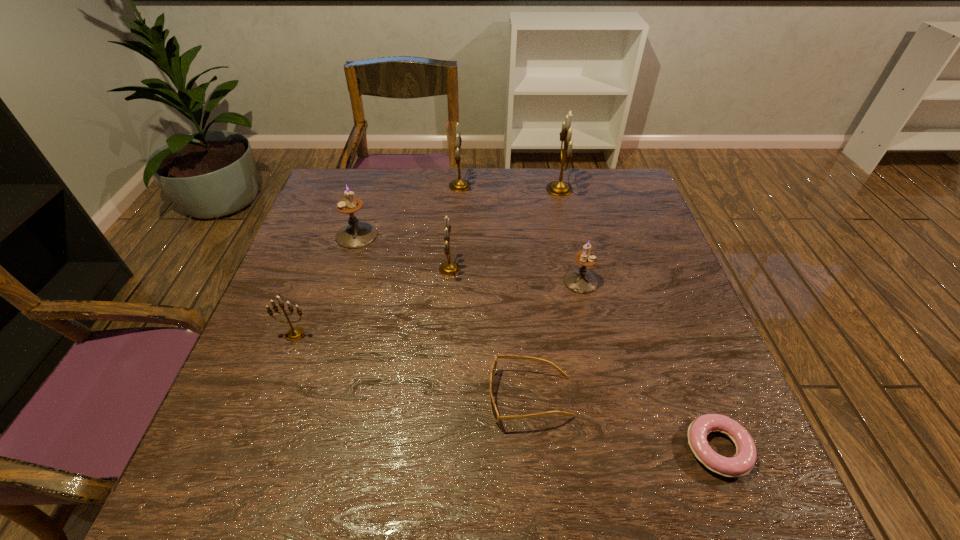
I want to click on free point located 0.110m on the front of the smallest gold candelabrum, so click(x=276, y=387).

You are a GUI agent. You are given a task and a screenshot of the screen. Output one action in this format:
    pyautogui.click(x=<x>, y=<y>)
    Task: Click on the free location located 0.400m on the front-facing side of the seventh tallest object
    The width and height of the screenshot is (960, 540).
    Given the screenshot: What is the action you would take?
    pyautogui.click(x=285, y=397)

Where is `vacant space situated on the front-facing side of the seventh tallest object`? The width and height of the screenshot is (960, 540). vacant space situated on the front-facing side of the seventh tallest object is located at coordinates (393, 397).

Where is `vacant area located 0.240m on the front-facing side of the seventh tallest object`? The height and width of the screenshot is (540, 960). vacant area located 0.240m on the front-facing side of the seventh tallest object is located at coordinates (367, 397).

Find the location of a particular element. free space located 0.290m on the back of the pink doughnut is located at coordinates (661, 304).

Where is `object at the near edge`? object at the near edge is located at coordinates (743, 461).

Locate an element on the screen. The height and width of the screenshot is (540, 960). object that is at the right edge is located at coordinates (743, 461).

Identify the location of object situated at the near right corner. (743, 461).

Where is `vacant space at the far edge`? vacant space at the far edge is located at coordinates (524, 172).

This screenshot has height=540, width=960. I want to click on free space at the left edge of the desktop, so click(x=323, y=283).